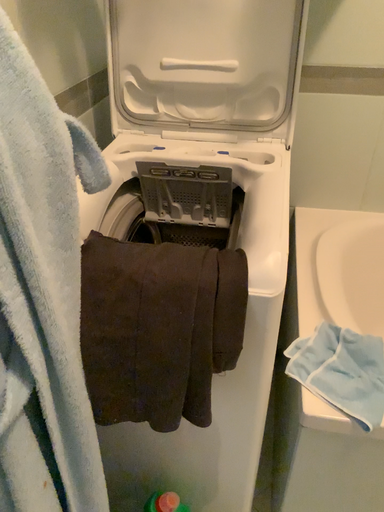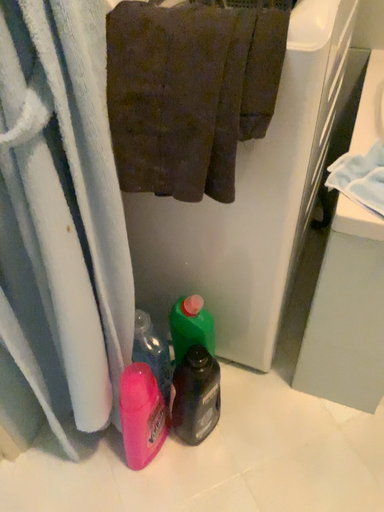
Question: How did the camera likely rotate when shooting the video?

Choices:
 (A) rotated downward
 (B) rotated upward

Answer: (A)